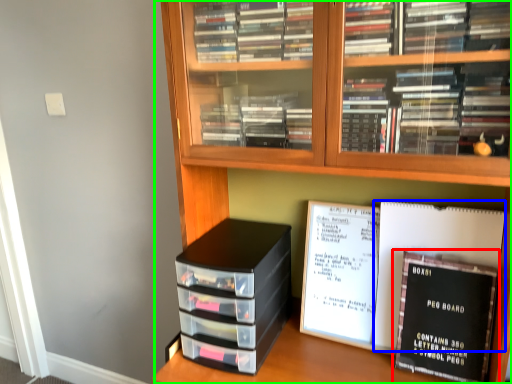
Question: Which object is the closest to the book (highlighted by a red box)? Choose among these: journal (highlighted by a blue box) or bookcase (highlighted by a green box).

Choices:
 (A) journal
 (B) bookcase

Answer: (A)